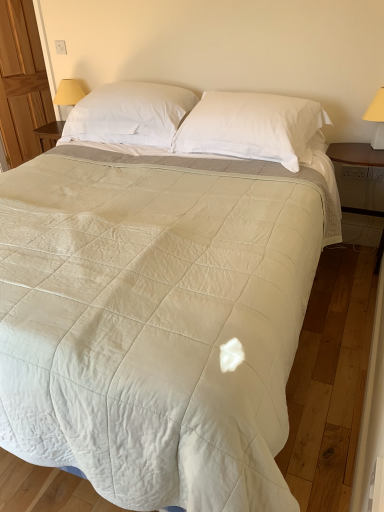
Question: From the image's perspective, is yellow fabric lampshade at right, which ranks as the 1th table lamp in right-to-left order, located beneath white soft pillow at upper center, which is the second pillow in right-to-left order?

Choices:
 (A) no
 (B) yes

Answer: (B)

Question: Is white soft pillow at upper center, which is the second pillow in right-to-left order, at the back of yellow fabric lampshade at right, which ranks as the 1th table lamp in right-to-left order?

Choices:
 (A) yes
 (B) no

Answer: (B)

Question: Is yellow fabric lampshade at right, positioned as the first table lamp in front-to-back order, shorter than white soft pillow at upper center, which is the second pillow in right-to-left order?

Choices:
 (A) yes
 (B) no

Answer: (A)

Question: Does yellow fabric lampshade at right, marked as the 2th table lamp in a left-to-right arrangement, come behind white soft pillow at upper center, which is the second pillow in right-to-left order?

Choices:
 (A) no
 (B) yes

Answer: (A)

Question: Could you tell me if yellow fabric lampshade at right, which ranks as the 1th table lamp in right-to-left order, is turned towards white soft pillow at upper center, which is the first pillow from left to right?

Choices:
 (A) no
 (B) yes

Answer: (A)

Question: Considering the positions of yellow fabric lampshade at right, which ranks as the 1th table lamp in right-to-left order, and white soft pillow at upper center, which is the first pillow from left to right, in the image, is yellow fabric lampshade at right, which ranks as the 1th table lamp in right-to-left order, wider or thinner than white soft pillow at upper center, which is the first pillow from left to right,?

Choices:
 (A) wide
 (B) thin

Answer: (B)

Question: From the image's perspective, relative to white soft pillow at upper center, which is the first pillow from left to right, is yellow fabric lampshade at right, marked as the 2th table lamp in a left-to-right arrangement, above or below?

Choices:
 (A) below
 (B) above

Answer: (A)

Question: In the image, is yellow fabric lampshade at right, marked as the 2th table lamp in a left-to-right arrangement, on the left side or the right side of white soft pillow at upper center, which is the second pillow in right-to-left order?

Choices:
 (A) left
 (B) right

Answer: (B)

Question: In the image, is yellow fabric lampshade at right, which is the second table lamp from back to front, positioned in front of or behind white soft pillow at upper center, which is the first pillow from left to right?

Choices:
 (A) behind
 (B) front

Answer: (B)

Question: Considering the relative positions of white soft pillow at upper center, which is the second pillow in right-to-left order, and yellow fabric lampshade at right, marked as the 2th table lamp in a left-to-right arrangement, in the image provided, is white soft pillow at upper center, which is the second pillow in right-to-left order, to the left or to the right of yellow fabric lampshade at right, marked as the 2th table lamp in a left-to-right arrangement,?

Choices:
 (A) left
 (B) right

Answer: (A)

Question: From a real-world perspective, is white soft pillow at upper center, which is the first pillow from left to right, above or below yellow fabric lampshade at right, marked as the 2th table lamp in a left-to-right arrangement?

Choices:
 (A) below
 (B) above

Answer: (B)

Question: Is white soft pillow at upper center, which is the first pillow from left to right, spatially inside yellow fabric lampshade at right, which is the second table lamp from back to front, or outside of it?

Choices:
 (A) inside
 (B) outside

Answer: (B)

Question: Relative to yellow fabric lampshade at right, positioned as the first table lamp in front-to-back order, is white soft pillow at upper center, which is the second pillow in right-to-left order, in front or behind?

Choices:
 (A) behind
 (B) front

Answer: (A)

Question: Would you say yellow fabric lampshade at right, the first table lamp when ordered from bottom to top, is to the left or to the right of white soft pillow at center, the second pillow positioned from the left, in the picture?

Choices:
 (A) left
 (B) right

Answer: (B)

Question: From a real-world perspective, is yellow fabric lampshade at right, which appears as the 2th table lamp when viewed from the top, physically located above or below white soft pillow at center, the second pillow positioned from the left?

Choices:
 (A) below
 (B) above

Answer: (B)